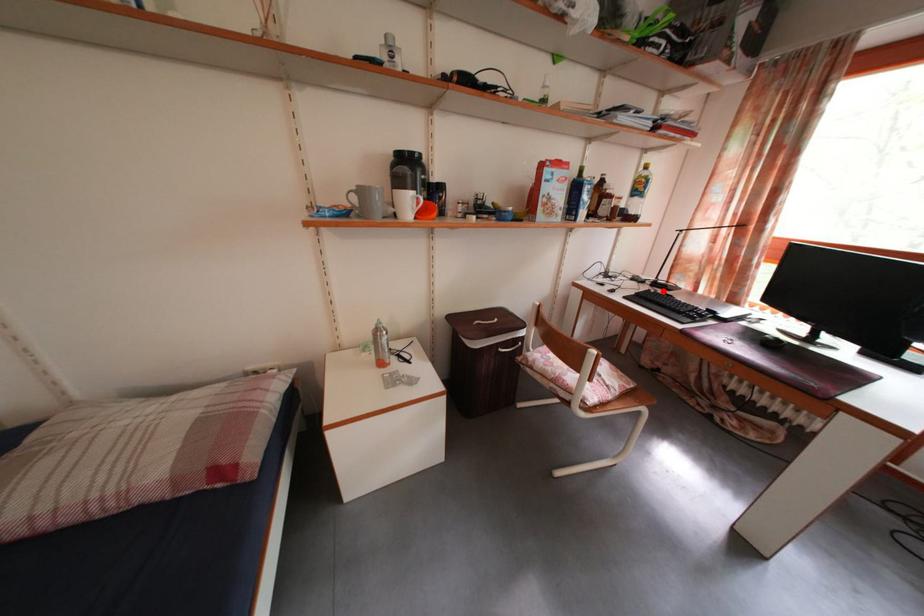
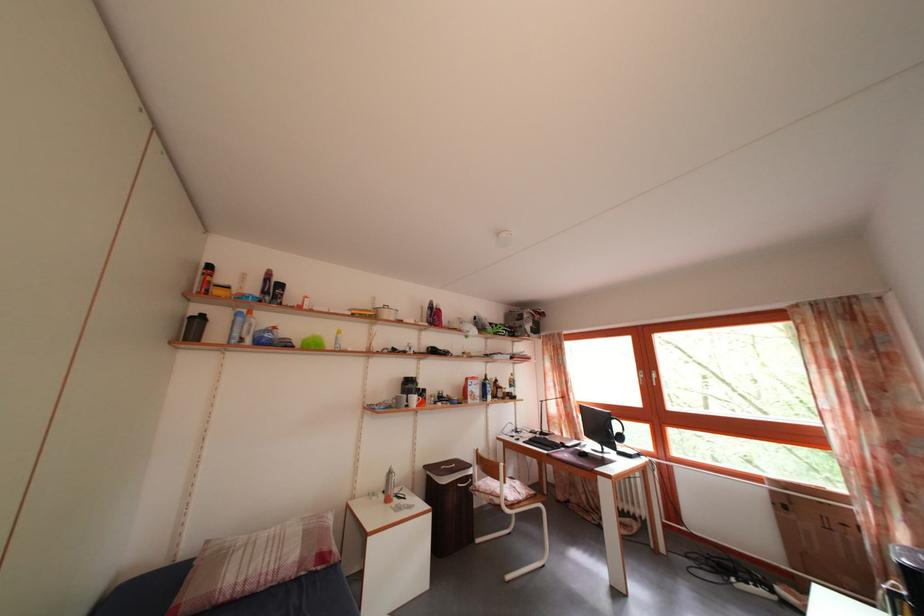
Question: I am providing you with two images of the same scene from different viewpoints. Image1 has a red point marked. In image2, the corresponding 3D location appears at what relative position? Reply with the corresponding letter.

Choices:
 (A) Closer
 (B) Farther

Answer: (B)